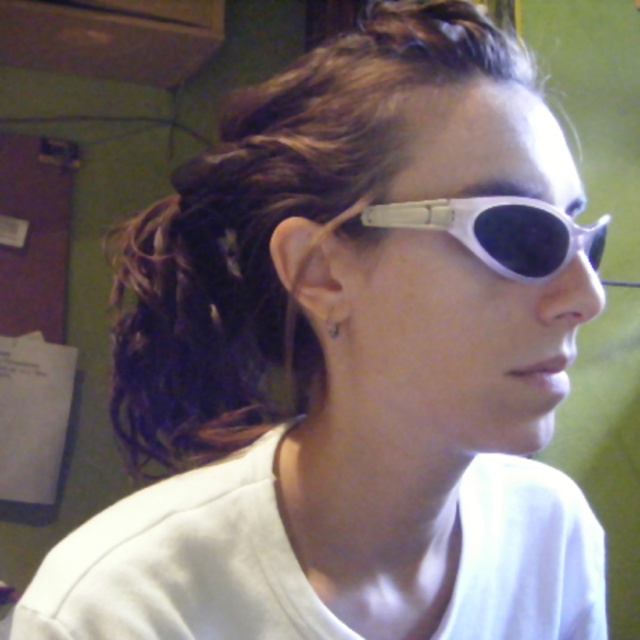
Is white matte sunglasses at upper center positioned behind silver metallic earring at ear?

That is False.

Does white matte sunglasses at upper center appear on the right side of silver metallic earring at ear?

Indeed, white matte sunglasses at upper center is positioned on the right side of silver metallic earring at ear.

The height and width of the screenshot is (640, 640). In order to click on white matte sunglasses at upper center in this screenshot , I will do `click(500, 230)`.